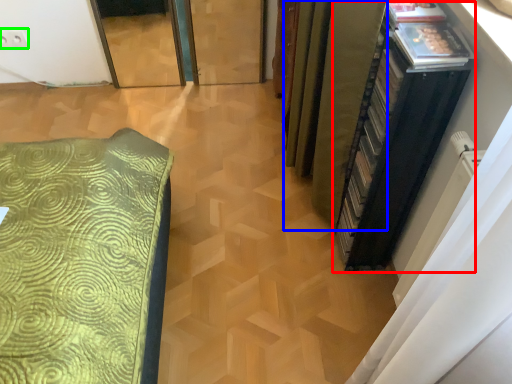
Question: Which is nearer to the file cabinet (highlighted by a red box)? curtain (highlighted by a blue box) or electric outlet (highlighted by a green box).

Choices:
 (A) curtain
 (B) electric outlet

Answer: (A)